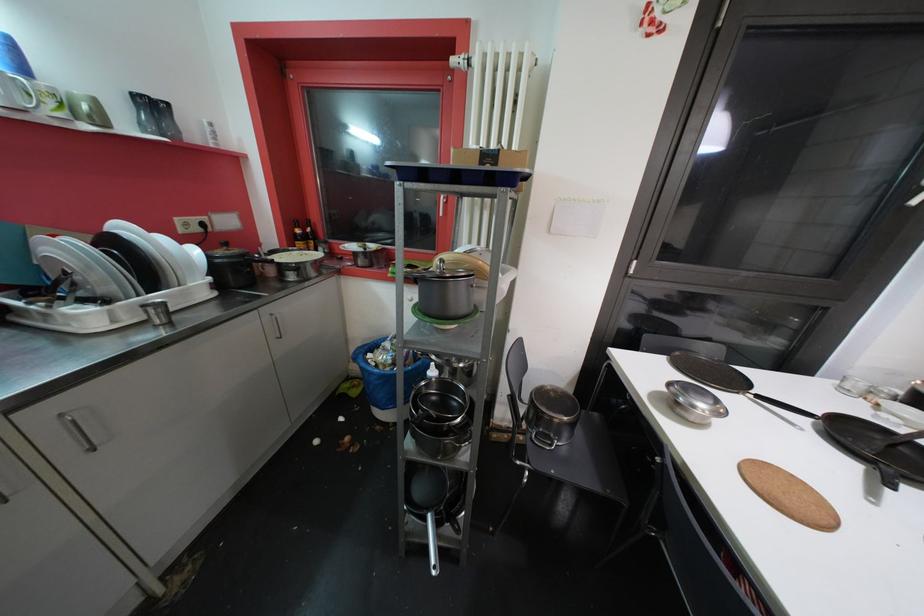
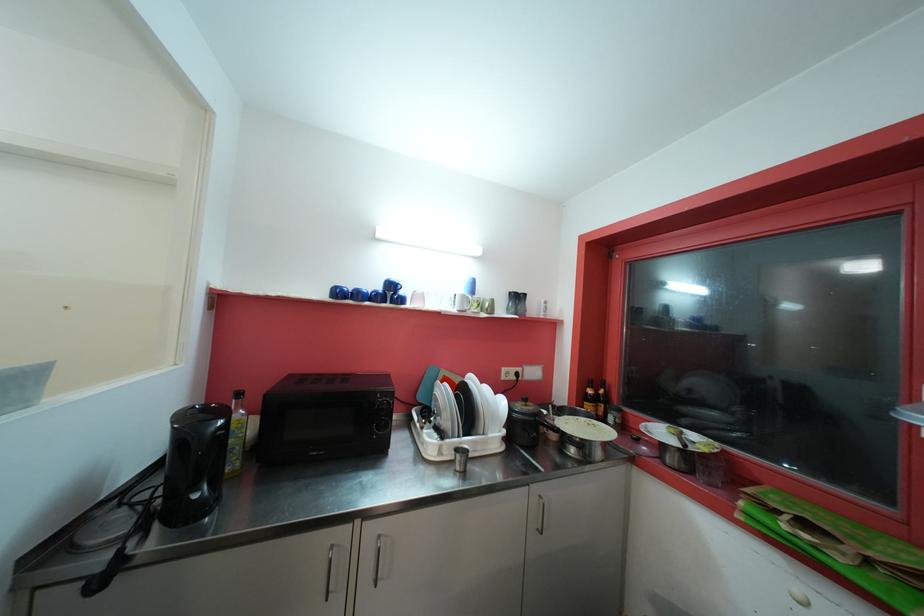
Find the pixel in the second image that matches the point at 305,246 in the first image.

(592, 408)